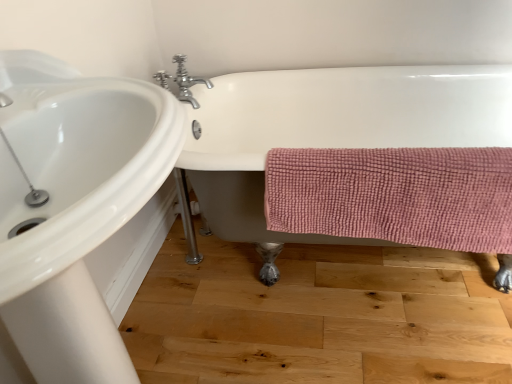
Question: Does chrome metallic faucet at upper center appear on the left side of white glossy sink at upper left?

Choices:
 (A) no
 (B) yes

Answer: (A)

Question: Is chrome metallic faucet at upper center with white glossy sink at upper left?

Choices:
 (A) no
 (B) yes

Answer: (A)

Question: Considering the relative positions of chrome metallic faucet at upper center and white glossy sink at upper left in the image provided, is chrome metallic faucet at upper center to the right of white glossy sink at upper left from the viewer's perspective?

Choices:
 (A) yes
 (B) no

Answer: (A)

Question: Considering the relative sizes of chrome metallic faucet at upper center and white glossy sink at upper left in the image provided, is chrome metallic faucet at upper center bigger than white glossy sink at upper left?

Choices:
 (A) yes
 (B) no

Answer: (B)

Question: Is chrome metallic faucet at upper center outside white glossy sink at upper left?

Choices:
 (A) no
 (B) yes

Answer: (B)

Question: Considering the relative sizes of chrome metallic faucet at upper center and white glossy sink at upper left in the image provided, is chrome metallic faucet at upper center thinner than white glossy sink at upper left?

Choices:
 (A) yes
 (B) no

Answer: (A)

Question: Is pink textured towel at lower right completely or partially outside of white glossy bathtub at center?

Choices:
 (A) no
 (B) yes

Answer: (A)

Question: From a real-world perspective, does pink textured towel at lower right sit lower than white glossy bathtub at center?

Choices:
 (A) no
 (B) yes

Answer: (A)

Question: Considering the relative positions of pink textured towel at lower right and white glossy bathtub at center in the image provided, is pink textured towel at lower right to the left of white glossy bathtub at center from the viewer's perspective?

Choices:
 (A) yes
 (B) no

Answer: (A)

Question: Does pink textured towel at lower right have a larger size compared to white glossy bathtub at center?

Choices:
 (A) yes
 (B) no

Answer: (B)

Question: Is pink textured towel at lower right next to white glossy bathtub at center?

Choices:
 (A) no
 (B) yes

Answer: (A)

Question: Could you tell me if pink textured towel at lower right is turned towards white glossy bathtub at center?

Choices:
 (A) no
 (B) yes

Answer: (B)

Question: Is white glossy bathtub at center positioned beyond the bounds of chrome metallic faucet at upper center?

Choices:
 (A) yes
 (B) no

Answer: (A)